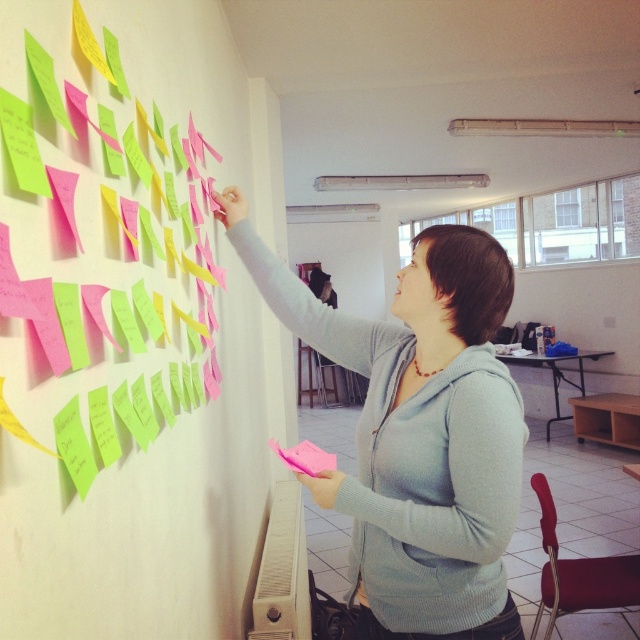
Based on the photo, can you confirm if pink paper notes at upper left is positioned to the left of light blue sweater at upper center?

Indeed, pink paper notes at upper left is positioned on the left side of light blue sweater at upper center.

From the picture: Does pink paper notes at upper left appear under light blue sweater at upper center?

Actually, pink paper notes at upper left is above light blue sweater at upper center.

Who is more distant from viewer, (8, 385) or (419, 353)?

Point (419, 353)

This screenshot has height=640, width=640. Identify the location of pink paper notes at upper left. (157, 502).